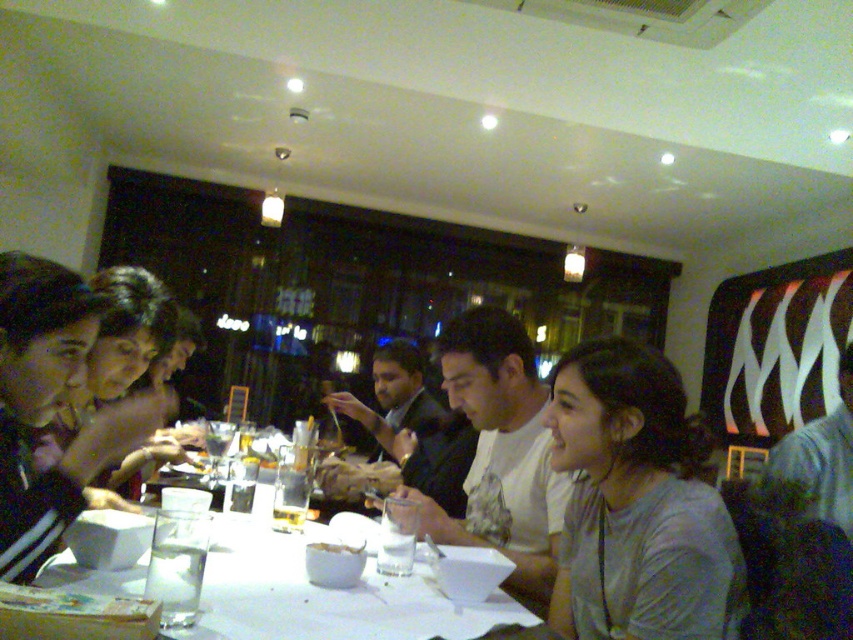
You are a photographer standing at the entrance of the restaurant. You want to take a photo of the white matte shirt at center. Where should you position your camera to capture the shirt in the frame?

To capture the white matte shirt at center, position your camera at the entrance facing towards the center of the dining area, as the shirt is located at point 0.708 on the x axis and 0.586 on the y axis.

In the scene shown: You are a server in a restaurant and need to place a new drink order for the table. The drink is 10 cm tall. Can you place it on the white paper table at center without it being blocked by the dark gray shirt at center?

The white paper table at center is not as tall as dark gray shirt at center, meaning the shirt is taller. Since the drink is only 10 cm tall, it might be blocked by the shirt if placed on the table. Consider placing it in a different location where it won

You are a waiter in a restaurant and need to deliver a dessert menu to the customer wearing the white matte shirt at center and the denim shirt at lower right. Which customer should you approach first if you want to serve the one sitting to the left first?

The white matte shirt at center is positioned on the left side of denim shirt at lower right, so you should approach the customer wearing the white matte shirt at center first since they are sitting to the left of the denim shirt at lower right.